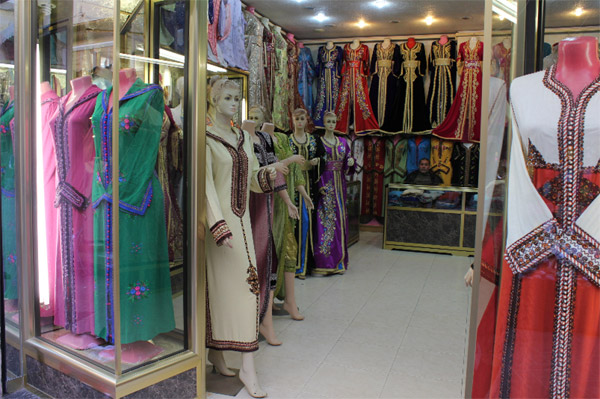
This screenshot has height=399, width=600. I want to click on counter, so click(x=426, y=234).